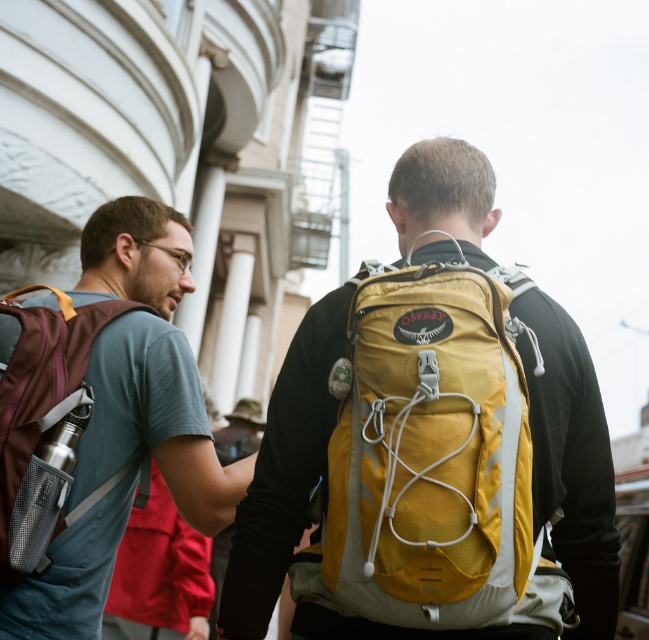
Question: Is yellow fabric backpack at center to the right of matte purple backpack at left from the viewer's perspective?

Choices:
 (A) yes
 (B) no

Answer: (A)

Question: Can you confirm if matte brown backpack at left is positioned to the right of matte purple backpack at left?

Choices:
 (A) no
 (B) yes

Answer: (A)

Question: Based on their relative distances, which object is nearer to the matte purple backpack at left?

Choices:
 (A) matte brown backpack at left
 (B) yellow fabric backpack at center

Answer: (A)

Question: Which of the following is the closest to the observer?

Choices:
 (A) (130, 211)
 (B) (459, 404)

Answer: (B)

Question: Observing the image, what is the correct spatial positioning of yellow fabric backpack at center in reference to matte brown backpack at left?

Choices:
 (A) below
 (B) above

Answer: (A)

Question: Among these points, which one is farthest from the camera?

Choices:
 (A) (347, 563)
 (B) (16, 392)

Answer: (B)